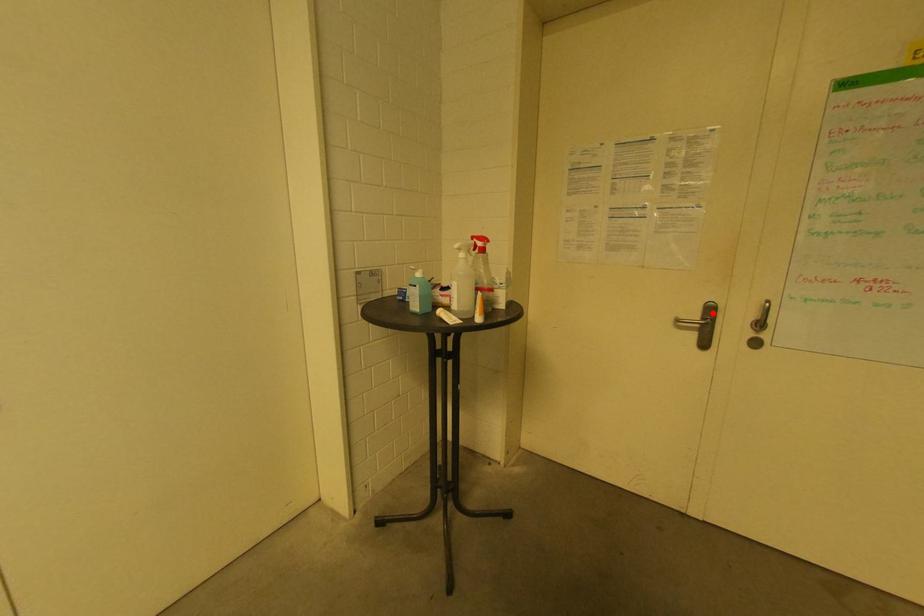
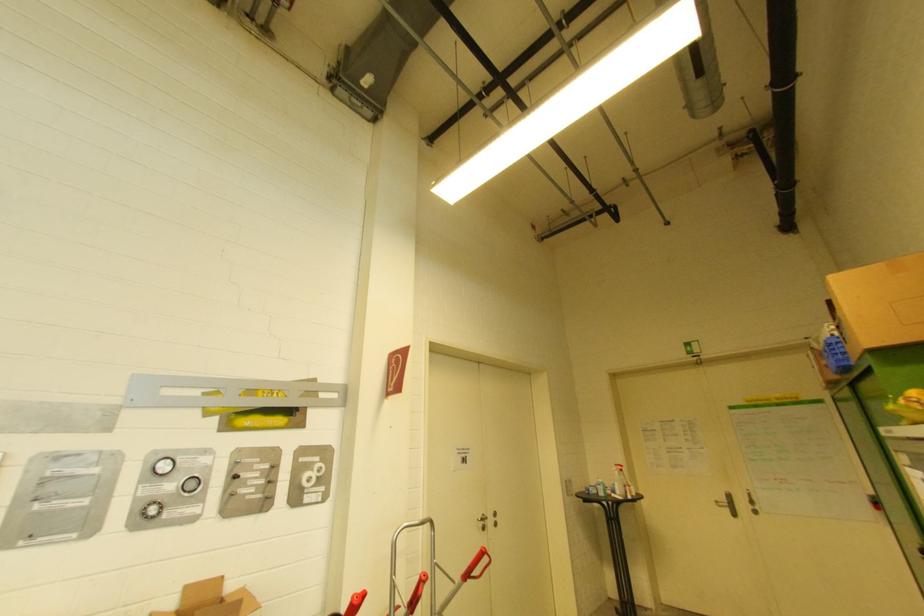
Question: I am providing you with two images of the same scene from different viewpoints. A red point is marked on the first image. Is the red point's position out of view in image 2?

Choices:
 (A) Yes
 (B) No

Answer: (B)